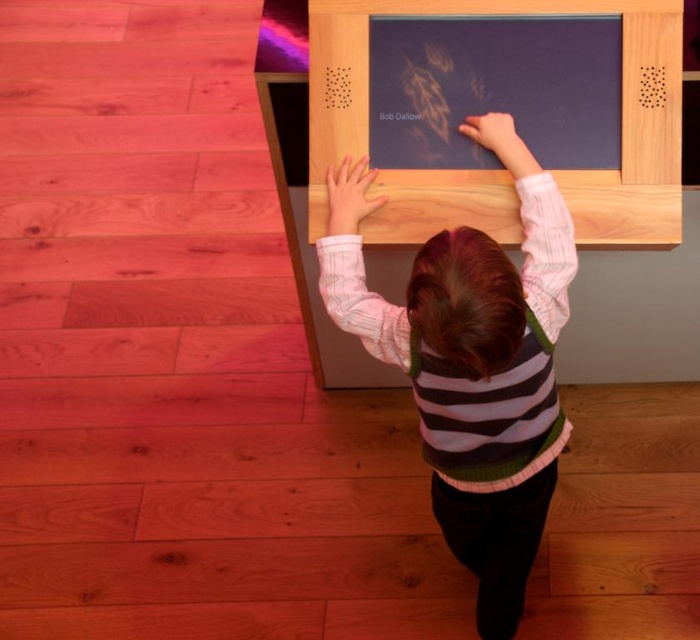
You are standing at the point labeled as point (413, 116) and want to reach the point labeled as point (539, 356). Which direction should you move to get there?

You should move forward because point (539, 356) is in front of point (413, 116).

You are a photographer trying to capture the striped sweater at center and the matte wooden board at upper center in the same frame. Based on their positions, can you see both objects fully without moving the camera?

The striped sweater at center is in front of the matte wooden board at upper center, so the sweater may block part of the board. Adjust the camera angle to ensure both are visible.